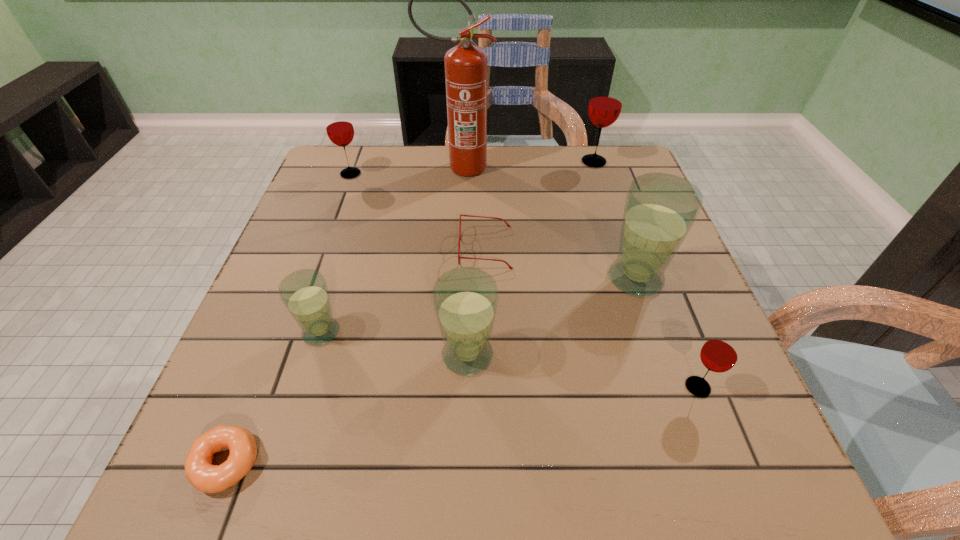
This screenshot has height=540, width=960. I want to click on red fire extinguisher, so click(466, 65).

Locate an element on the screen. This screenshot has width=960, height=540. fire extinguisher is located at coordinates (466, 65).

Find the location of a particular element. This screenshot has height=540, width=960. the biggest red glass is located at coordinates (605, 104).

Identify the location of the biggest blue glass. The height and width of the screenshot is (540, 960). (660, 209).

Find the location of `the farthest blue glass`. the farthest blue glass is located at coordinates (660, 209).

Image resolution: width=960 pixels, height=540 pixels. In order to click on the leftmost red glass in this screenshot , I will do pyautogui.click(x=339, y=127).

Identify the location of the second blue glass from left to right. The image size is (960, 540). (465, 299).

Locate an element on the screen. Image resolution: width=960 pixels, height=540 pixels. the second biggest blue glass is located at coordinates (465, 299).

Where is `the smallest blue glass`? This screenshot has height=540, width=960. the smallest blue glass is located at coordinates (x=304, y=293).

Identify the location of the smallest red glass. This screenshot has width=960, height=540. (721, 351).